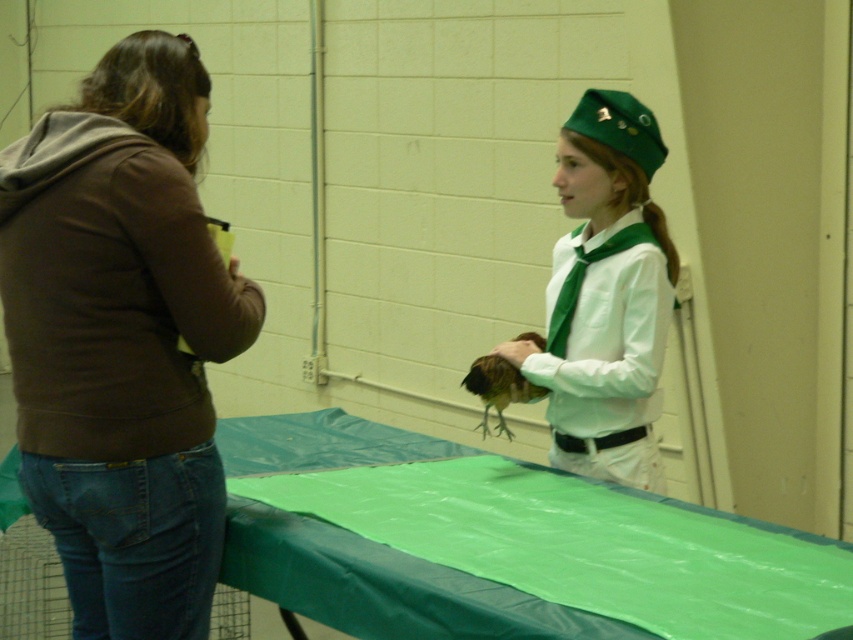
Question: Does brown cotton hoodie at left have a greater width compared to green matte uniform at center?

Choices:
 (A) yes
 (B) no

Answer: (A)

Question: Among these points, which one is nearest to the camera?

Choices:
 (A) (222, 307)
 (B) (579, 307)

Answer: (A)

Question: Is brown cotton hoodie at left to the right of green matte uniform at center from the viewer's perspective?

Choices:
 (A) yes
 (B) no

Answer: (B)

Question: Is brown cotton hoodie at left further to camera compared to green matte uniform at center?

Choices:
 (A) yes
 (B) no

Answer: (B)

Question: Which object appears farthest from the camera in this image?

Choices:
 (A) brown cotton hoodie at left
 (B) green matte uniform at center

Answer: (B)